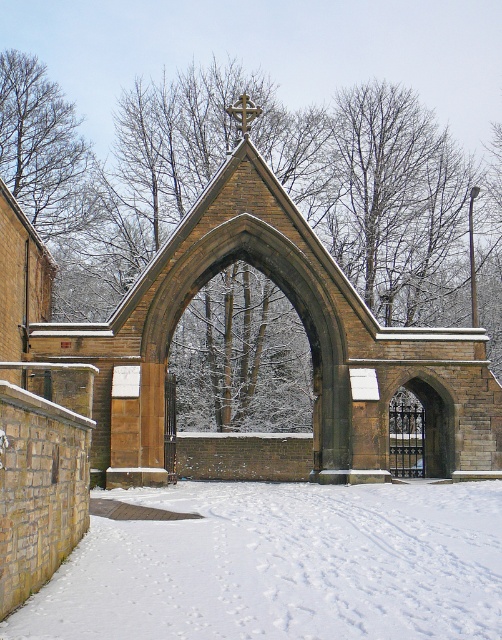
You are standing in front of the grand arched stone gateway in the winter scene. You notice a point marked at coordinates (x=282, y=564). What object or feature is located at that point?

The point at coordinates (x=282, y=564) indicates white powdery snow at lower center.

You are standing in front of the grand arched stone gateway. You see the white powdery snow at lower center and the brown stone church at center. Which object is positioned lower in the scene?

The white powdery snow at lower center is positioned lower than the brown stone church at center.